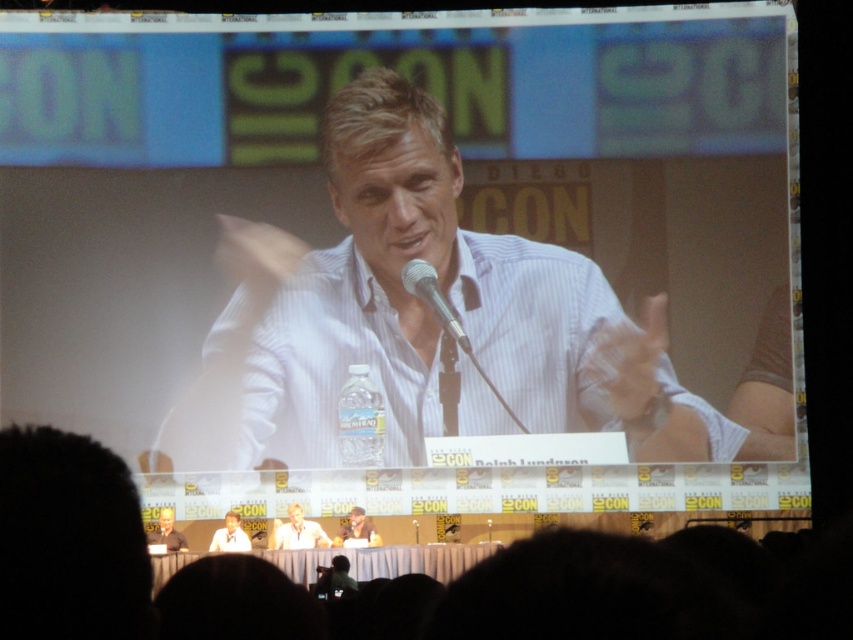
Question: Can you confirm if light blue striped shirt at center is wider than smooth brown leather jacket at center?

Choices:
 (A) no
 (B) yes

Answer: (A)

Question: Among these points, which one is nearest to the camera?

Choices:
 (A) (450, 312)
 (B) (355, 349)

Answer: (A)

Question: Can you confirm if silver metallic microphone at center is thinner than smooth brown leather jacket at center?

Choices:
 (A) no
 (B) yes

Answer: (B)

Question: Does light brown wood table at lower center appear under smooth brown leather jacket at center?

Choices:
 (A) no
 (B) yes

Answer: (A)

Question: Which of these objects is positioned closest to the white striped shirt at center?

Choices:
 (A) light brown hair at lower left
 (B) light brown wood table at lower center

Answer: (B)

Question: Which object appears closest to the camera in this image?

Choices:
 (A) light brown hair at lower left
 (B) light blue striped shirt at center
 (C) white striped shirt at center

Answer: (B)